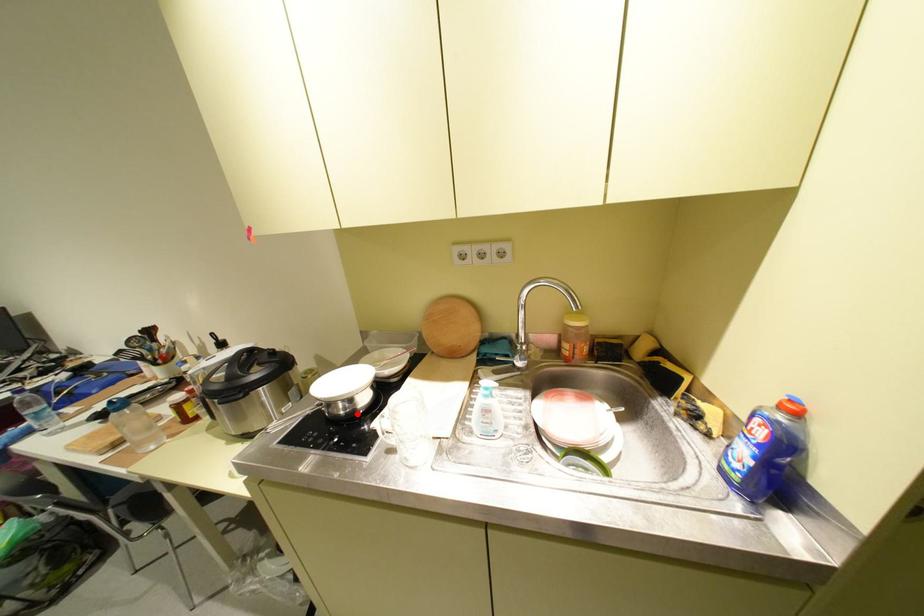
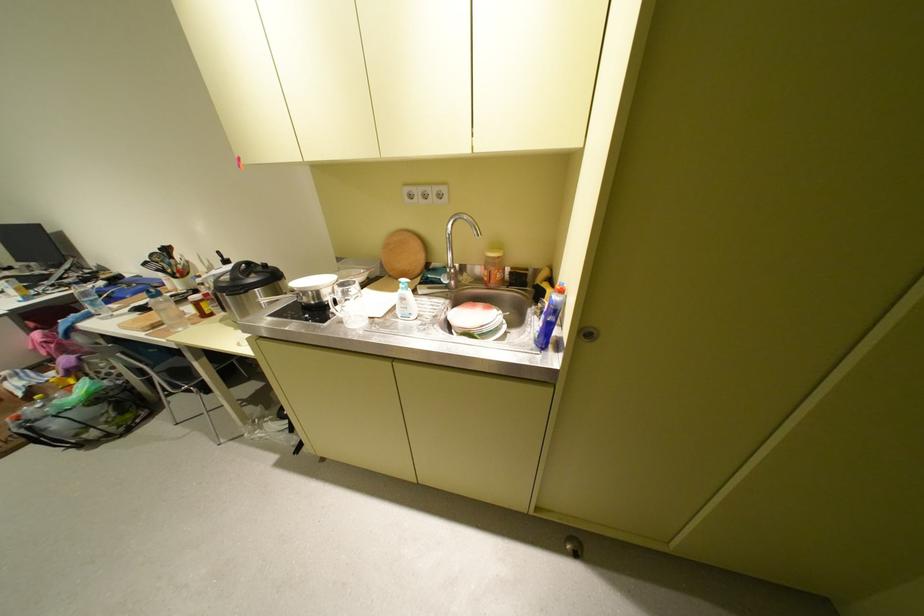
Where in the second image is the point corresponding to the highlighted location from the first image?

(326, 304)